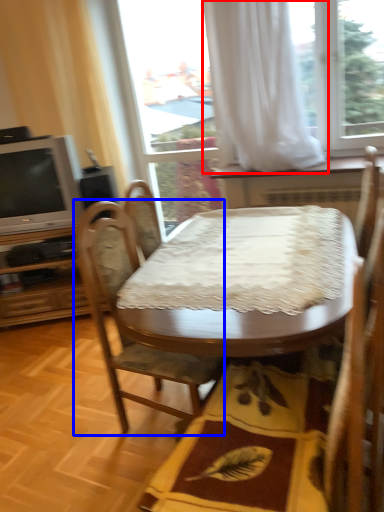
Question: Which point is further to the camera, curtain (highlighted by a red box) or chair (highlighted by a blue box)?

Choices:
 (A) curtain
 (B) chair

Answer: (A)